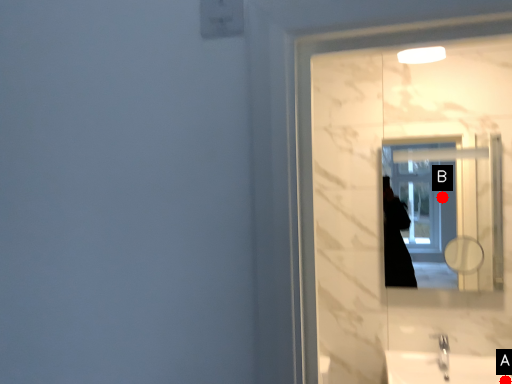
Question: Two points are circled on the image, labeled by A and B beside each circle. Which of the following is the farthest from the observer?

Choices:
 (A) A is further
 (B) B is further

Answer: (B)